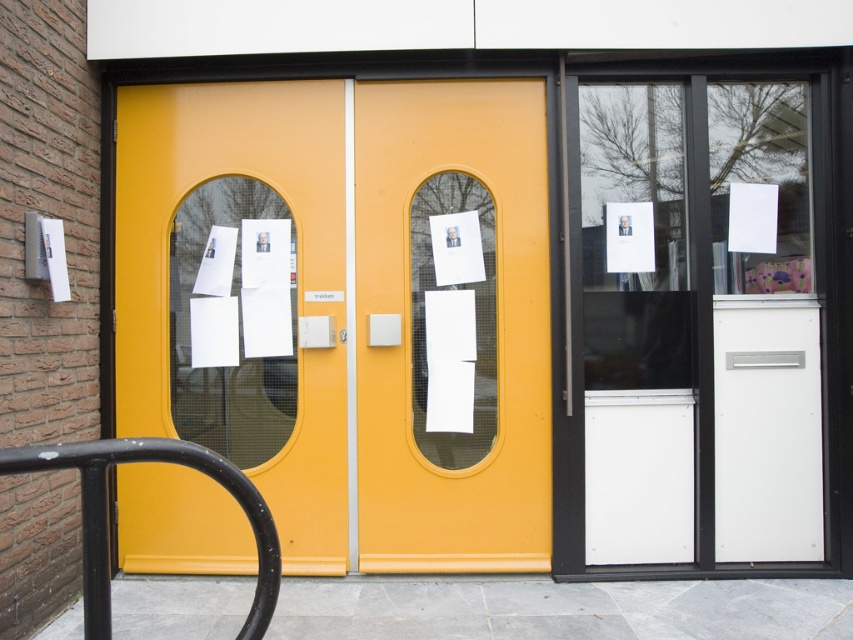
Question: Observing the image, what is the correct spatial positioning of transparent glass door at right in reference to matte yellow door at center?

Choices:
 (A) below
 (B) above

Answer: (B)

Question: From the image, what is the correct spatial relationship of transparent glass door at right in relation to matte yellow door at left?

Choices:
 (A) left
 (B) right

Answer: (B)

Question: Which point is farther to the camera?

Choices:
 (A) (259, 564)
 (B) (325, 426)
 (C) (717, 84)

Answer: (C)

Question: Which is nearer to the matte yellow door at center?

Choices:
 (A) matte glass window at center left
 (B) matte yellow door at left

Answer: (B)

Question: Which point is closer to the camera?

Choices:
 (A) pos(838,301)
 (B) pos(396,116)

Answer: (A)

Question: Is matte yellow door at center smaller than black metal/rail at lower left?

Choices:
 (A) no
 (B) yes

Answer: (A)